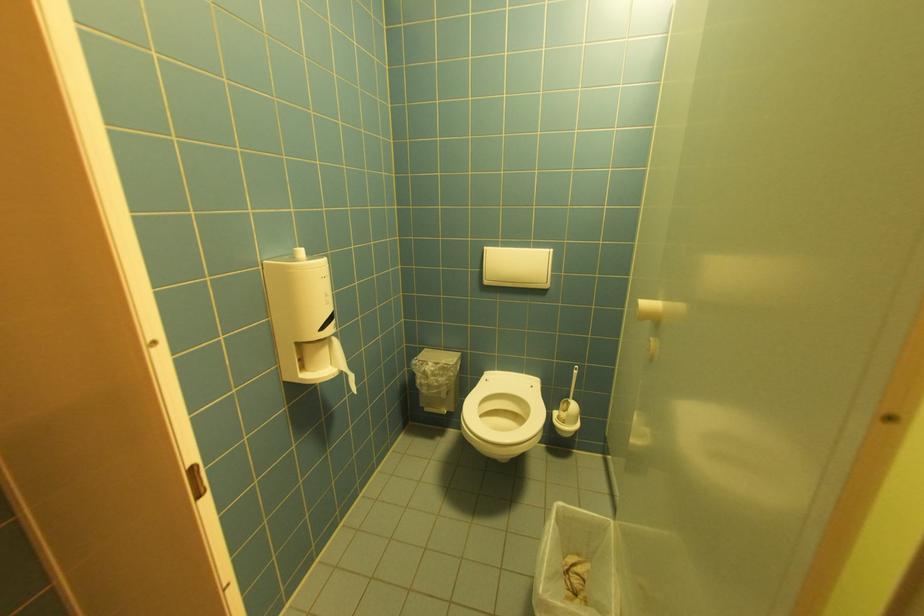
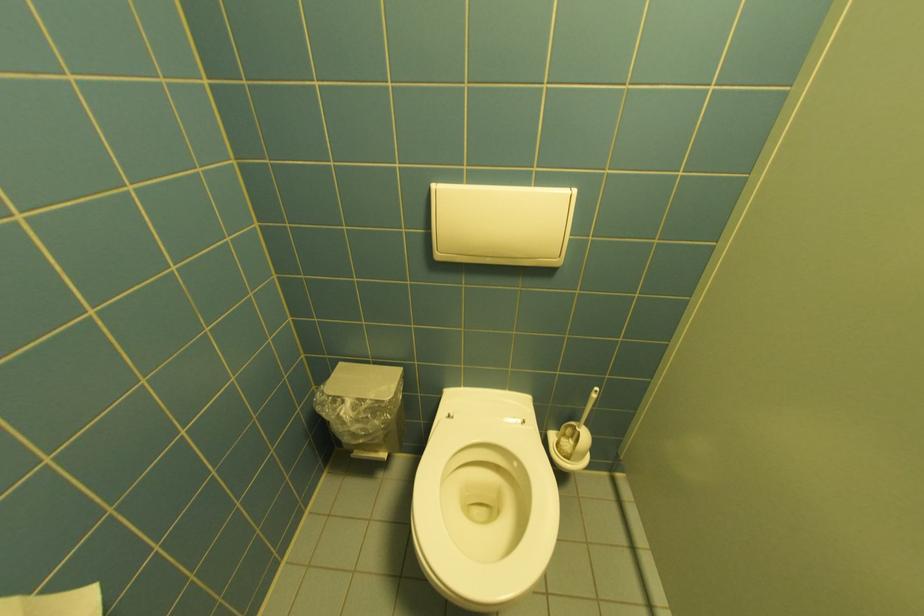
Question: The first image is from the beginning of the video and the second image is from the end. How did the camera likely rotate when shooting the video?

Choices:
 (A) Left
 (B) Right
 (C) Up
 (D) Down

Answer: (D)